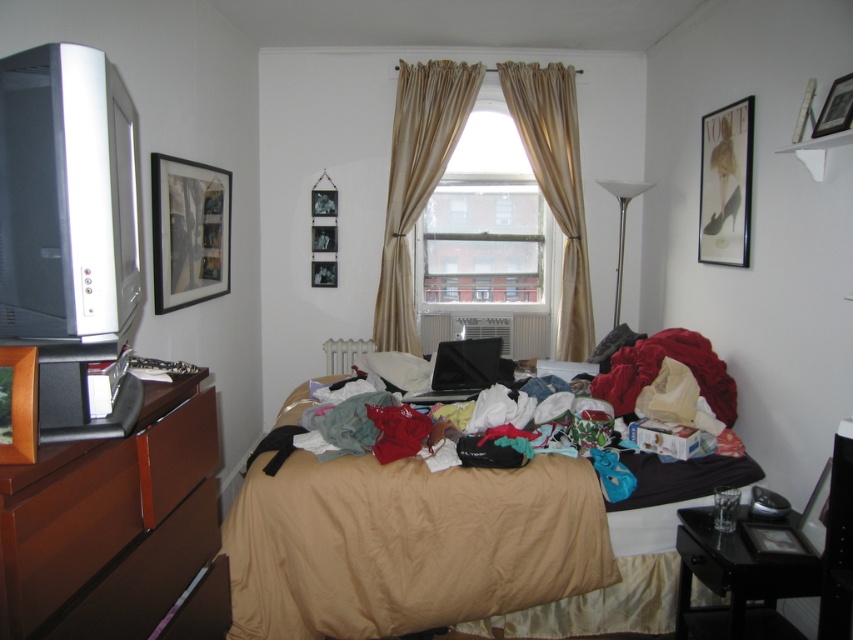
Does black matte laptop at center come in front of metallic silver picture frame at upper right?

No, black matte laptop at center is behind metallic silver picture frame at upper right.

I want to click on black matte laptop at center, so click(461, 369).

This screenshot has width=853, height=640. In order to click on brown wood dresser at left in this screenshot , I will do `click(111, 522)`.

This screenshot has width=853, height=640. What do you see at coordinates (111, 522) in the screenshot?
I see `brown wood dresser at left` at bounding box center [111, 522].

Locate an element on the screen. This screenshot has height=640, width=853. brown wood dresser at left is located at coordinates (111, 522).

Between point (276, 528) and point (579, 173), which one is positioned in front?

Point (276, 528)

Is point (433, 474) farther from viewer compared to point (554, 102)?

That is False.

This screenshot has height=640, width=853. Find the location of `multicolored fabric bed at center`. multicolored fabric bed at center is located at coordinates (456, 547).